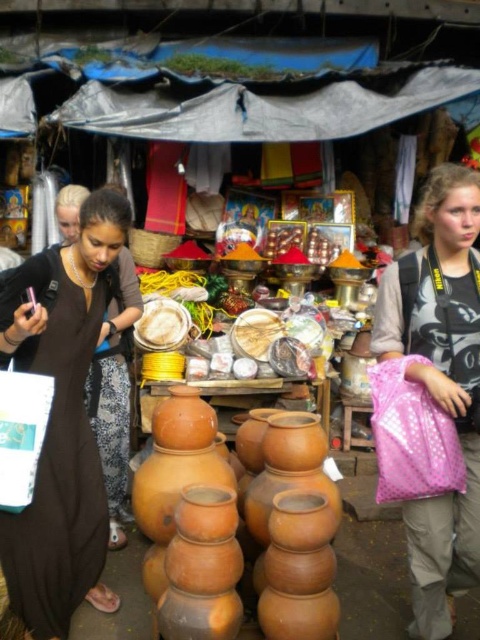
You are a photographer standing at the market and want to take a photo that includes both the stack of terracotta pots in the foreground and the vendor stall in the background. You notice two points marked as point 1 at coordinates [443,600] and point 2 at coordinates [156,337]. Which point should you focus on to ensure both the foreground and background are in sharp focus?

You should focus on point 1 at coordinates [443,600] because it is closer to the camera than point 2 at coordinates [156,337]. Focusing on the closer point will help keep both the foreground and background in focus.

You are a customer at the market and want to know which point is nearer to you. The points are labeled as point 1 at coordinates (98,228) and point 2 at coordinates (304,429). Which point is closer to you?

Point 1 at coordinates (98,228) is closer to the viewer than point 2 at coordinates (304,429).